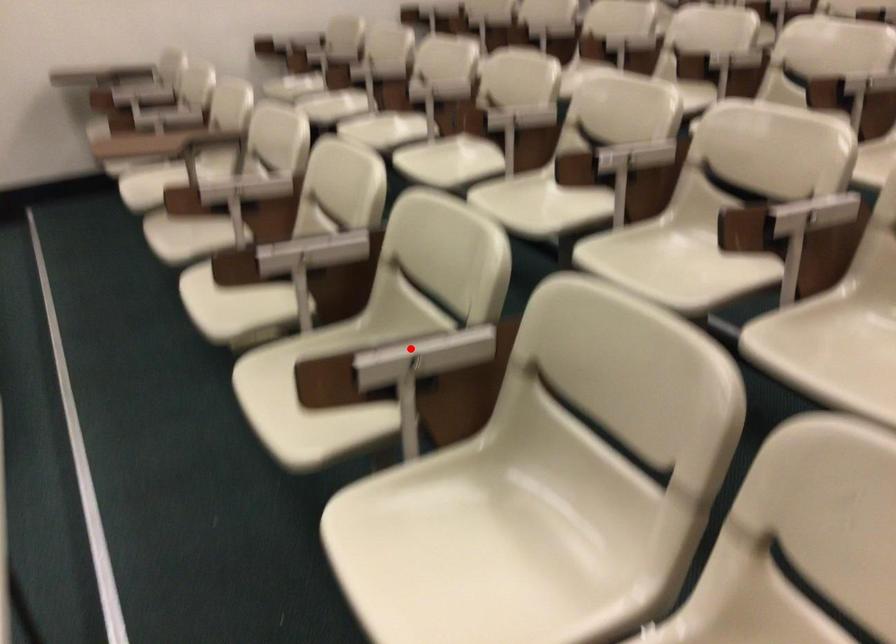
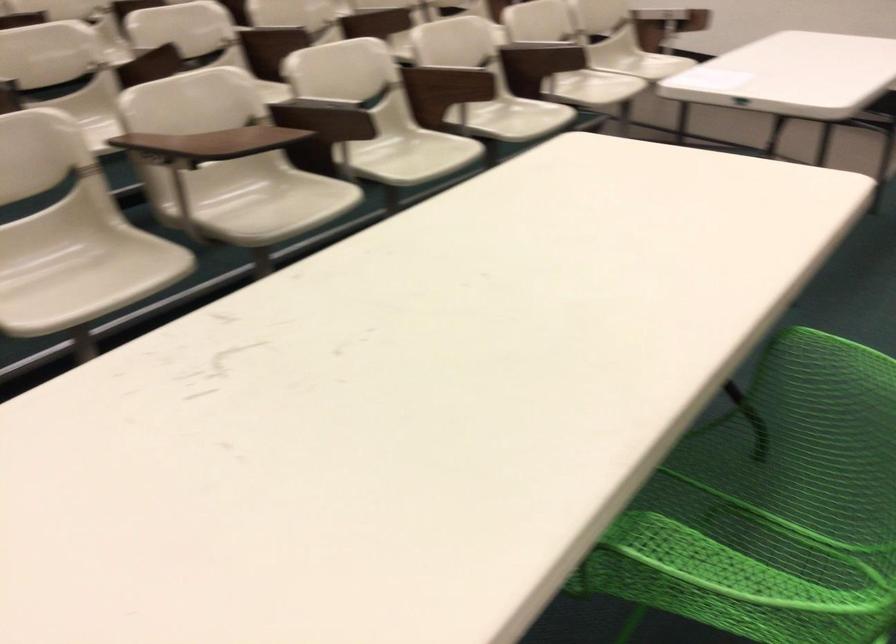
Locate, in the second image, the point that corresponds to the highlighted location in the first image.

(543, 49)